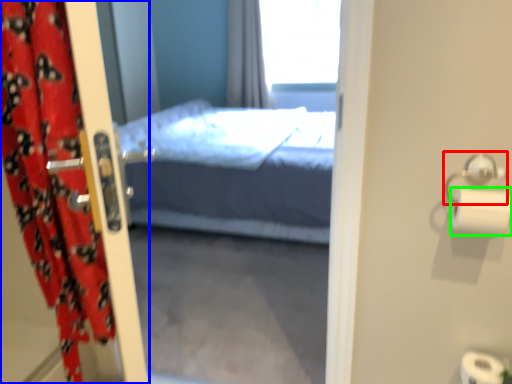
Question: Which is nearer to the towel bar (highlighted by a red box)? curtain (highlighted by a blue box) or toilet paper (highlighted by a green box).

Choices:
 (A) curtain
 (B) toilet paper

Answer: (B)